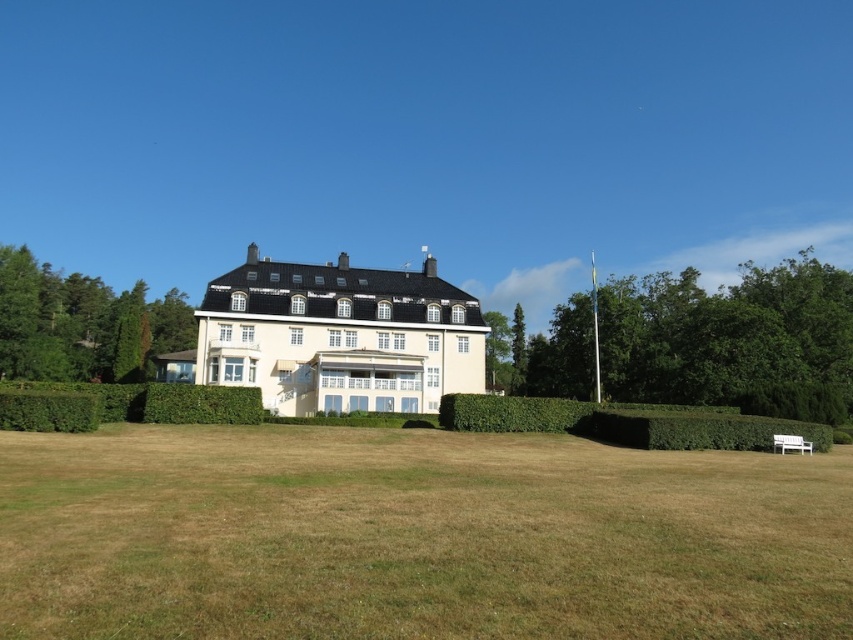
You are a landscape architect designing a garden path that needs to be placed between the green leafy tree at right and the green leafy hedge at lower right. Based on their widths, which one should you consider for the path placement to ensure it doesn t get blocked by the wider object?

The green leafy tree at right might be wider than the green leafy hedge at lower right, so you should consider the tree s width when planning the path to avoid blockage.

Looking at this image, you are standing at the entrance of the building and want to walk towards the brown grass at center. Which direction should you turn to avoid the green leafy hedge at lower left?

The brown grass at center is to the right of the green leafy hedge at lower left, so you should turn right to avoid the green leafy hedge at lower left and head towards the brown grass at center.